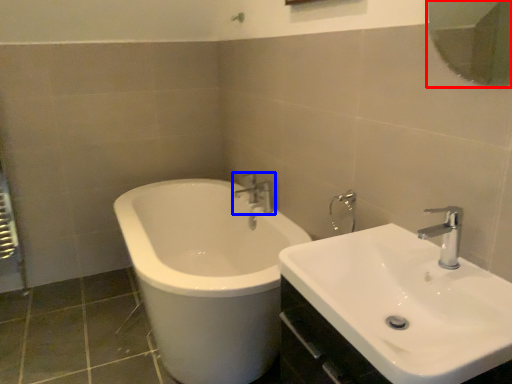
Question: Among these objects, which one is farthest to the camera, mirror (highlighted by a red box) or tap (highlighted by a blue box)?

Choices:
 (A) mirror
 (B) tap

Answer: (B)